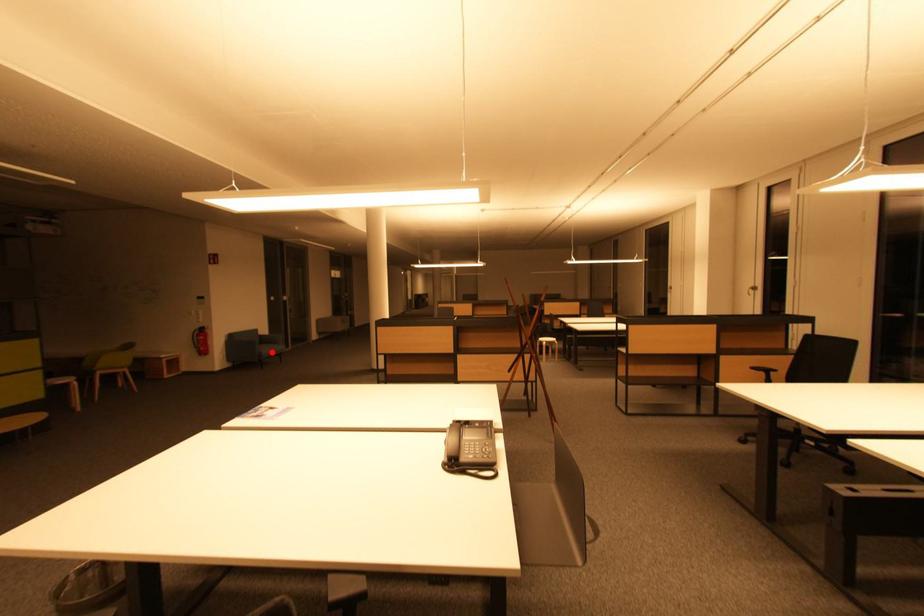
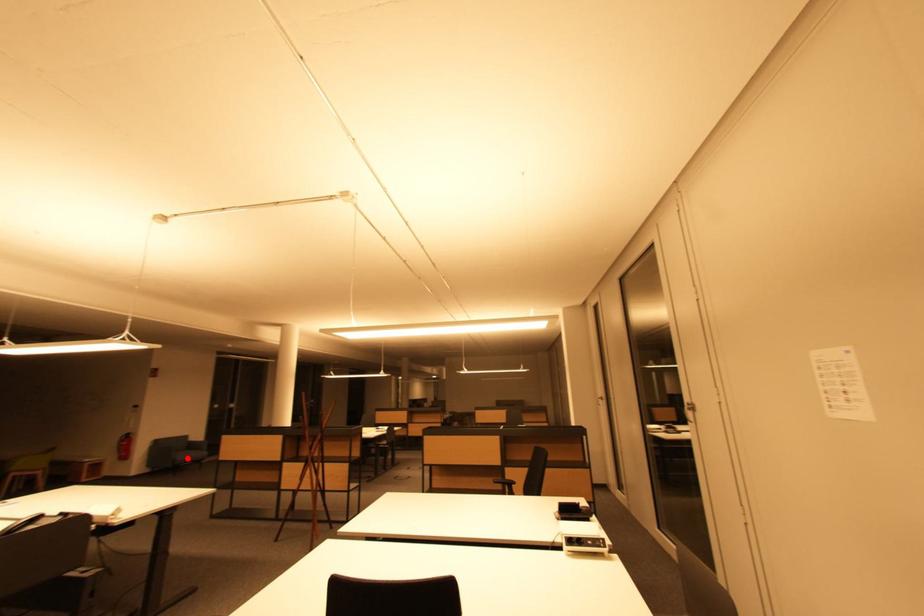
I am providing you with two images of the same scene from different viewpoints. A red point is marked on the first image and another point is marked on the second image. Does the point marked in image1 correspond to the same location as the one in image2?

Yes